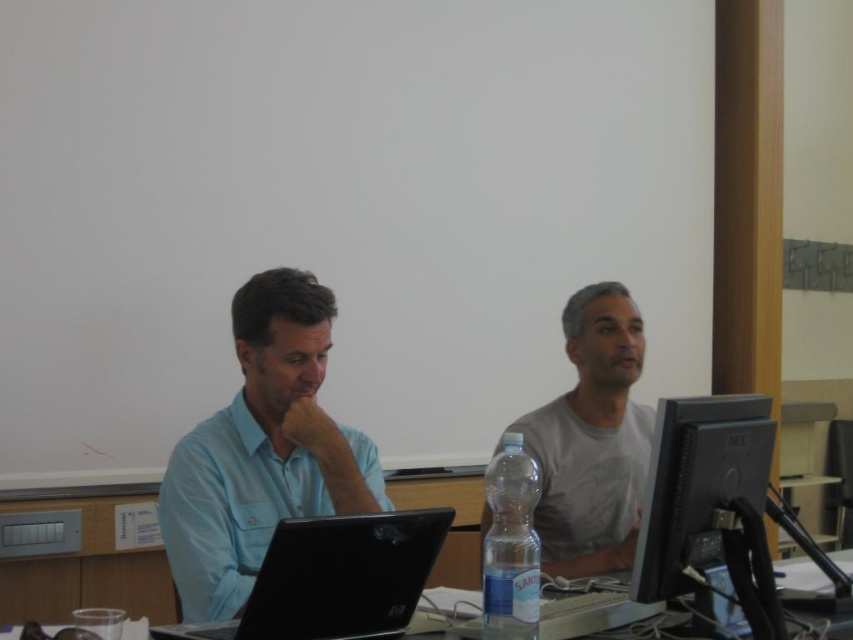
In the scene shown: You are a delivery person trying to place a 1.5 meter long package on the table between the black glossy monitor at right and the black plastic table at center. Will the package fit on the table without overlapping either object?

The black glossy monitor at right is 1.65 meters away from the black plastic table at center, so the 1.5 meter long package can fit on the table between them without overlapping either object.

You are organizing a small event and need to place a decorative centerpiece on the table between the gray cotton shirt at center and the clear plastic bottle at center. Based on their widths, which object should you avoid placing the centerpiece closer to?

You should avoid placing the centerpiece closer to the gray cotton shirt at center because it might be wider than the clear plastic bottle at center, potentially blocking the space needed for the centerpiece.

You are standing in front of the table and want to place a small notebook between the black glossy monitor at right and the black plastic table at center. Based on their positions, which object should the notebook be placed closer to?

The black glossy monitor at right is closer to the viewer than the black plastic table at center, so the notebook should be placed closer to the black glossy monitor at right to maintain proximity to the observer.